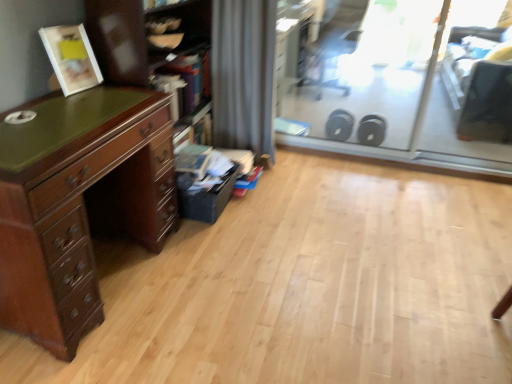
Question: Does transparent glass screen door at upper right, the first screen door positioned from the left, have a lesser width compared to transparent plastic screen door at upper right, acting as the 1th screen door starting from the right?

Choices:
 (A) no
 (B) yes

Answer: (A)

Question: Is transparent glass screen door at upper right, the second screen door when ordered from right to left, wider than transparent plastic screen door at upper right, acting as the 1th screen door starting from the right?

Choices:
 (A) yes
 (B) no

Answer: (A)

Question: Is transparent glass screen door at upper right, the first screen door positioned from the left, taller than transparent plastic screen door at upper right, which is the second screen door from left to right?

Choices:
 (A) yes
 (B) no

Answer: (A)

Question: From a real-world perspective, is transparent glass screen door at upper right, the second screen door when ordered from right to left, positioned under transparent plastic screen door at upper right, acting as the 1th screen door starting from the right, based on gravity?

Choices:
 (A) yes
 (B) no

Answer: (A)

Question: From the image's perspective, is transparent glass screen door at upper right, the second screen door when ordered from right to left, located above transparent plastic screen door at upper right, which is the second screen door from left to right?

Choices:
 (A) yes
 (B) no

Answer: (A)

Question: Can you confirm if transparent glass screen door at upper right, the first screen door positioned from the left, is positioned to the left of transparent plastic screen door at upper right, acting as the 1th screen door starting from the right?

Choices:
 (A) yes
 (B) no

Answer: (A)

Question: Is black plastic swivel chair at upper right wider than transparent plastic screen door at upper right, which is the second screen door from left to right?

Choices:
 (A) no
 (B) yes

Answer: (B)

Question: From the image's perspective, is black plastic swivel chair at upper right under transparent plastic screen door at upper right, acting as the 1th screen door starting from the right?

Choices:
 (A) no
 (B) yes

Answer: (A)

Question: Is black plastic swivel chair at upper right thinner than transparent plastic screen door at upper right, acting as the 1th screen door starting from the right?

Choices:
 (A) yes
 (B) no

Answer: (B)

Question: Is black plastic swivel chair at upper right turned away from transparent plastic screen door at upper right, acting as the 1th screen door starting from the right?

Choices:
 (A) no
 (B) yes

Answer: (A)

Question: Could you tell me if black plastic swivel chair at upper right is turned towards transparent plastic screen door at upper right, which is the second screen door from left to right?

Choices:
 (A) no
 (B) yes

Answer: (A)

Question: Is black plastic swivel chair at upper right to the right of transparent plastic screen door at upper right, acting as the 1th screen door starting from the right, from the viewer's perspective?

Choices:
 (A) yes
 (B) no

Answer: (B)

Question: Is wooden bookshelf at left not inside black plastic swivel chair at upper right?

Choices:
 (A) no
 (B) yes

Answer: (B)